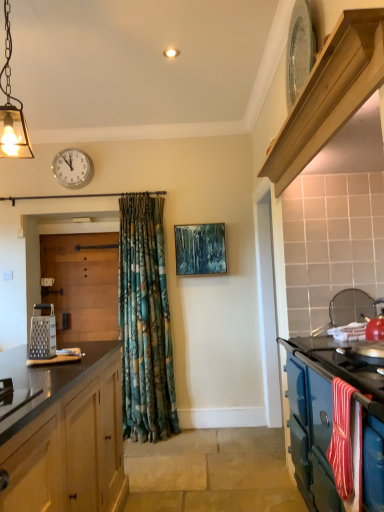
The image size is (384, 512). Find the location of `free point below textured blue painting at center (from a real-world perspective)`. free point below textured blue painting at center (from a real-world perspective) is located at coordinates (207, 425).